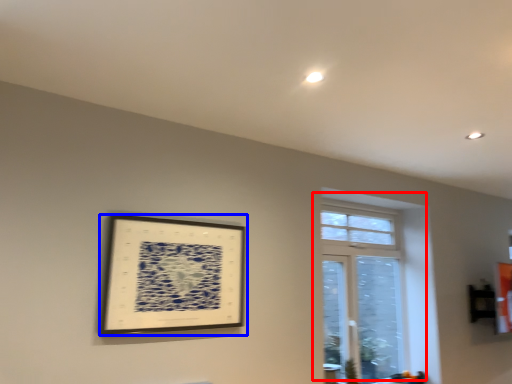
Question: Which object is further to the camera taking this photo, window (highlighted by a red box) or picture frame (highlighted by a blue box)?

Choices:
 (A) window
 (B) picture frame

Answer: (A)